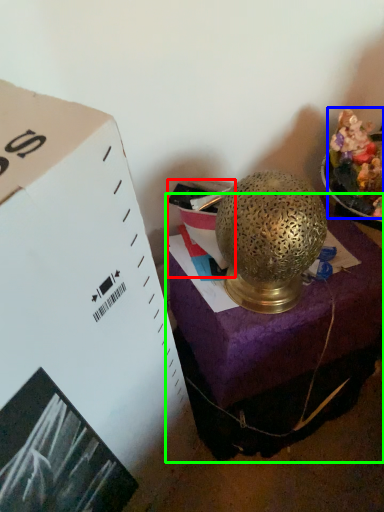
Question: Estimate the real-world distances between objects in this image. Which object is closer to box (highlighted by a red box), food (highlighted by a blue box) or furniture (highlighted by a green box)?

Choices:
 (A) food
 (B) furniture

Answer: (A)